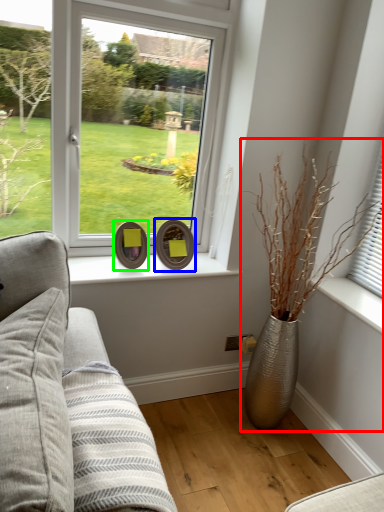
Question: Which object is positioned closest to houseplant (highlighted by a red box)? Select from picture frame (highlighted by a blue box) and picture frame (highlighted by a green box).

Choices:
 (A) picture frame
 (B) picture frame

Answer: (A)